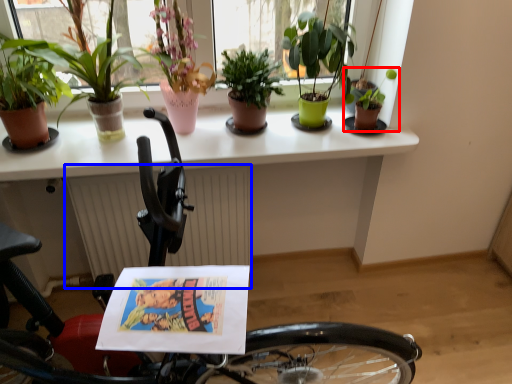
Question: Which of the following is the closest to the observer, houseplant (highlighted by a red box) or radiator (highlighted by a blue box)?

Choices:
 (A) houseplant
 (B) radiator

Answer: (A)